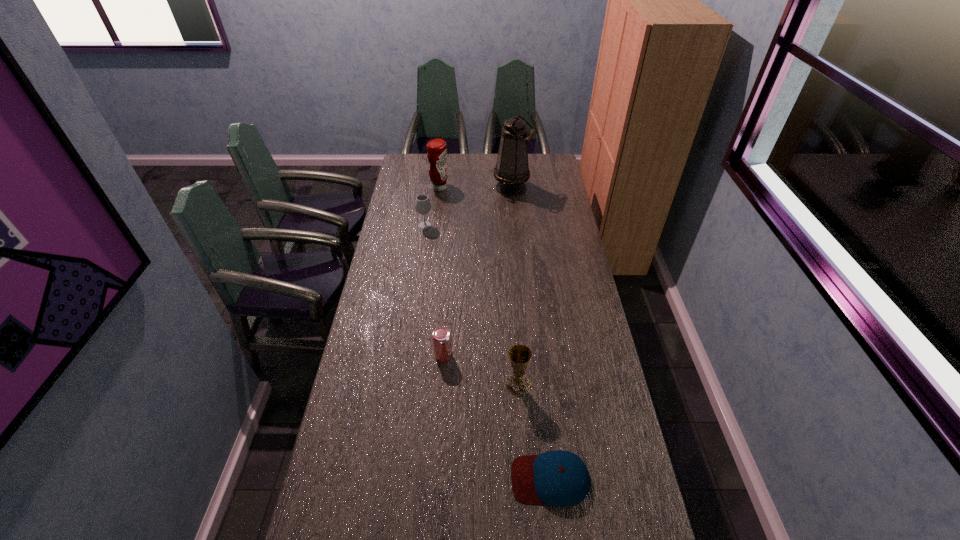
I want to click on vacant space situated 0.360m on the front of the chalice, so click(x=527, y=517).

Where is `blank space located 0.130m on the left of the wineglass`? The width and height of the screenshot is (960, 540). blank space located 0.130m on the left of the wineglass is located at coordinates (390, 226).

Find the location of `vacant area situated on the left of the beer can`. vacant area situated on the left of the beer can is located at coordinates (408, 355).

Locate an element on the screen. vacant space located with the bill of the baseball cap facing forward is located at coordinates (457, 479).

Where is `vacant region located 0.070m with the bill of the baseball cap facing forward`? This screenshot has width=960, height=540. vacant region located 0.070m with the bill of the baseball cap facing forward is located at coordinates (486, 479).

The image size is (960, 540). In order to click on vacant position located with the bill of the baseball cap facing forward in this screenshot , I will do `click(382, 479)`.

The image size is (960, 540). I want to click on object that is positioned at the left edge, so click(x=422, y=204).

This screenshot has height=540, width=960. Find the location of `object present at the right edge`. object present at the right edge is located at coordinates (559, 478).

The width and height of the screenshot is (960, 540). In the image, there is a desktop. What are the coordinates of `vacant space at the left edge` in the screenshot? It's located at (372, 493).

The height and width of the screenshot is (540, 960). Identify the location of vacant space at the right edge. (627, 500).